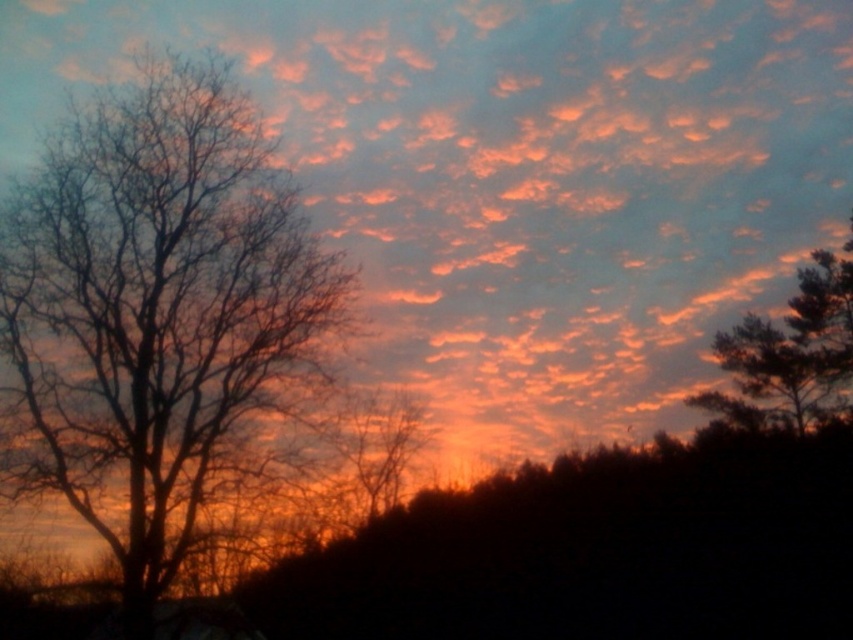
Between silhouette bark tree at left and silhouette bare tree at center, which one appears on the left side from the viewer's perspective?

Positioned to the left is silhouette bark tree at left.

Is point (79, 109) positioned in front of point (364, 516)?

Yes.

Identify the location of silhouette bark tree at left. The width and height of the screenshot is (853, 640). (157, 314).

Which is more to the left, silvery textured pine tree at upper right or silhouette bare tree at center?

silhouette bare tree at center

Can you confirm if silvery textured pine tree at upper right is positioned above silhouette bare tree at center?

Yes.

In the scene shown: Who is more distant from viewer, (x=833, y=305) or (x=358, y=476)?

The point (x=833, y=305) is behind.

At what (x,y) coordinates should I click in order to perform the action: click on silvery textured pine tree at upper right. Please return your answer as a coordinate pair (x, y). This screenshot has width=853, height=640. Looking at the image, I should click on (790, 349).

From the picture: Who is more forward, (x=209, y=266) or (x=755, y=428)?

Point (x=209, y=266)

Is point (70, 145) farther from camera compared to point (791, 404)?

No.

Image resolution: width=853 pixels, height=640 pixels. What are the coordinates of `silhouette bark tree at left` in the screenshot? It's located at (157, 314).